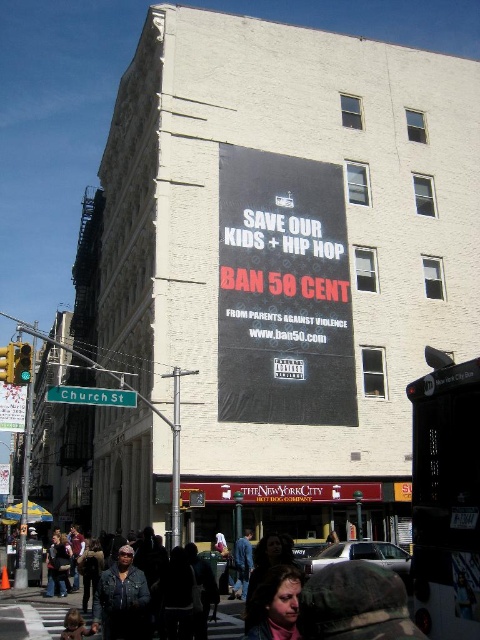
You are a street artist who wants to place a new sticker on the blue jeans at center. However, you can only place it if the blue jeans are taller than the black matte poster at center. Based on the scene, can you place the sticker?

The black matte poster at center is taller than blue jeans at center, so the sticker cannot be placed on the blue jeans at center since it is shorter than the poster.

You are a street artist who wants to place a new sticker on the largest object between the black matte poster at center and the blue jeans at center. Which object should you choose?

The black matte poster at center has a larger size compared to the blue jeans at center, so you should choose the black matte poster at center to place your sticker.